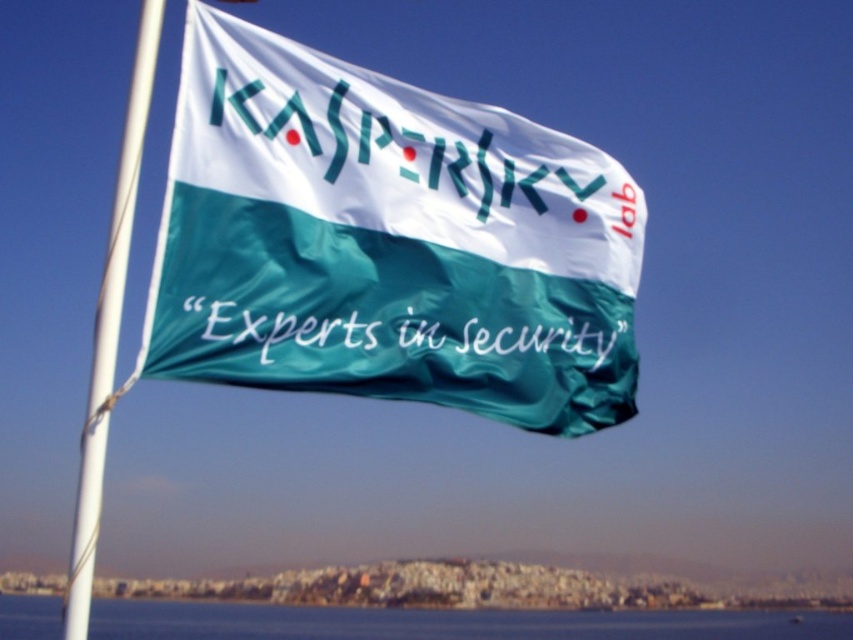
Question: Which of the following is the closest to the observer?

Choices:
 (A) (396, 304)
 (B) (270, 273)

Answer: (B)

Question: Which is nearer to the white plastic flag pole at left?

Choices:
 (A) silky green flag at center
 (B) white fabric text at center
 (C) blue water at lower center

Answer: (A)

Question: Can you confirm if white plastic flag pole at left is thinner than green fabric flag at center?

Choices:
 (A) no
 (B) yes

Answer: (A)

Question: Is white fabric text at center thinner than white plastic flag pole at left?

Choices:
 (A) yes
 (B) no

Answer: (A)

Question: Can you confirm if blue water at lower center is positioned to the left of green fabric flag at center?

Choices:
 (A) yes
 (B) no

Answer: (B)

Question: Which point appears closest to the camera in this image?

Choices:
 (A) (293, 625)
 (B) (123, 196)

Answer: (B)